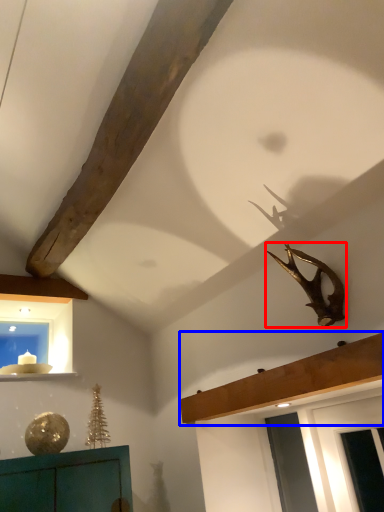
Question: Among these objects, which one is nearest to the camera, animal (highlighted by a red box) or shelf (highlighted by a blue box)?

Choices:
 (A) animal
 (B) shelf

Answer: (B)